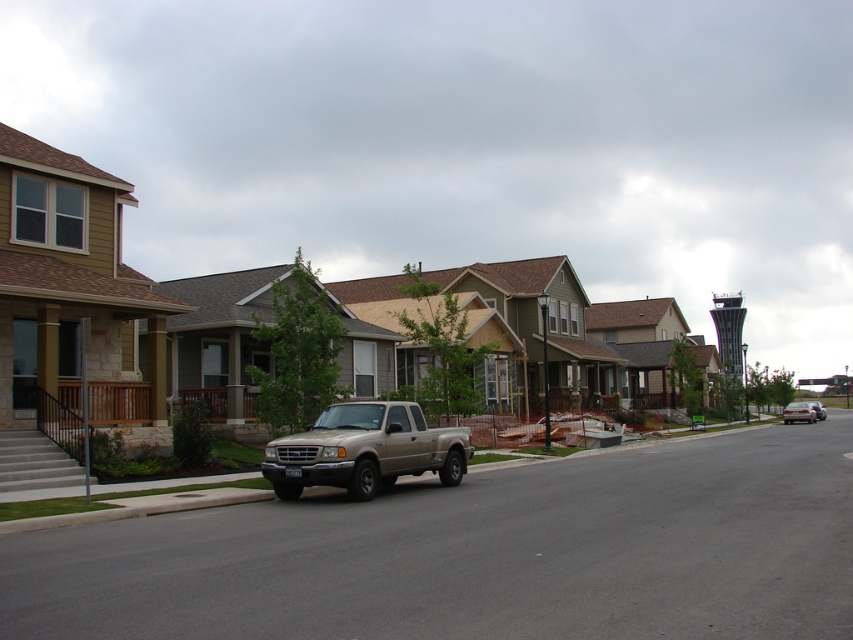
You are a delivery driver who needs to park your 5.5 meter long truck between the silver metallic sedan at right and the metallic silver sedan at center. Is there enough space between them to park your truck?

The silver metallic sedan at right is 8.39 meters away from the metallic silver sedan at center. Since the truck is 5.5 meters long, there is sufficient space between the two sedans to park the truck as the distance between them is greater than the truck length.

You are a delivery driver who needs to park your delivery van, which is 1.8 meters tall, between the silver metallic sedan at right and the metallic silver sedan at center. Based on the scene, can your van fit vertically between them without touching either car?

The silver metallic sedan at right is not as tall as metallic silver sedan at center. Since the delivery van is 1.8 meters tall, and the shorter sedan is the one on the right, the van should be able to fit between them as long as the height of the shorter sedan is less than 1.8 meters. However, without knowing the exact height of the shorter sedan, we cannot definitively confirm if the van will fit. The information provided only states a comparative height difference between the two sedans, not their actual

You are a delivery driver who needs to park your vehicle between the gold metallic truck at center and the silver metallic sedan at right. Given that your vehicle is 4.5 meters long, can you fit your vehicle in the available space between them?

The gold metallic truck at center is smaller than the silver metallic sedan at right. However, the description does not provide the exact distance between them, so we cannot determine if the 4.5 meter vehicle can fit. More information about the spacing between the two vehicles is needed.